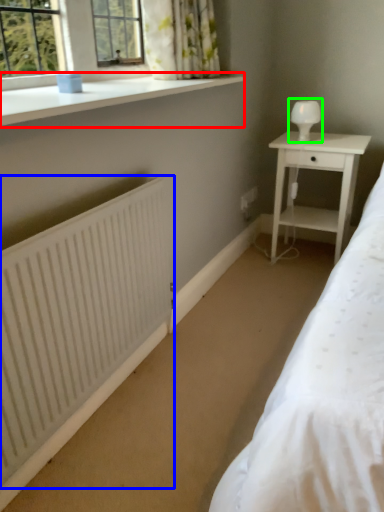
Question: Based on their relative distances, which object is farther from window sill (highlighted by a red box)? Choose from radiator (highlighted by a blue box) and table lamp (highlighted by a green box).

Choices:
 (A) radiator
 (B) table lamp

Answer: (B)